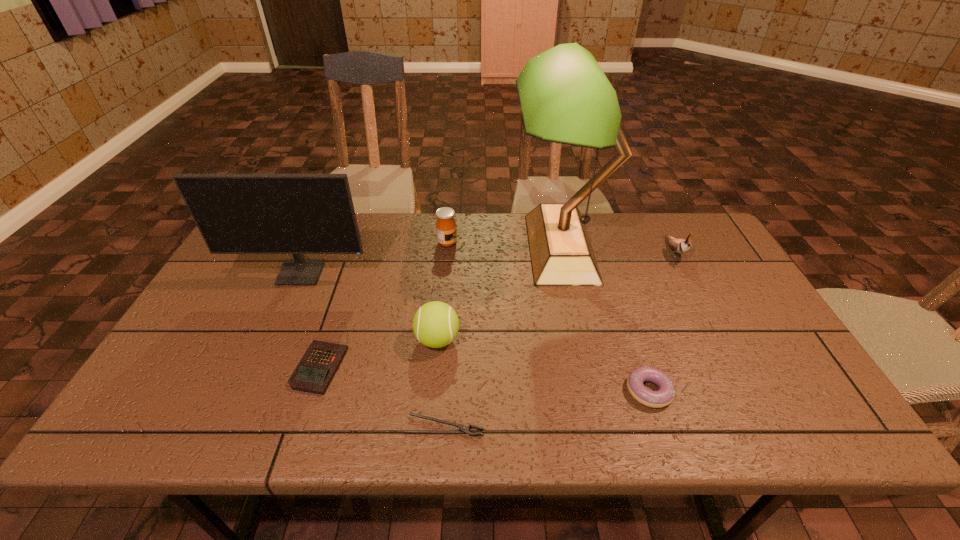
Locate an element on the screen. The height and width of the screenshot is (540, 960). honey located at the far edge is located at coordinates (446, 231).

I want to click on bird positioned at the far edge, so click(681, 246).

Image resolution: width=960 pixels, height=540 pixels. In order to click on doughnut located at the near edge in this screenshot , I will do `click(665, 395)`.

Locate an element on the screen. Image resolution: width=960 pixels, height=540 pixels. tongs present at the near edge is located at coordinates (463, 429).

Find the location of a particular element. object located in the left edge section of the desktop is located at coordinates (297, 214).

The width and height of the screenshot is (960, 540). What are the coordinates of `object that is at the right edge` in the screenshot? It's located at (681, 246).

Identify the location of object that is at the far right corner. Image resolution: width=960 pixels, height=540 pixels. (681, 246).

The height and width of the screenshot is (540, 960). Identify the location of vacant space at the far edge. (632, 244).

In the image, there is a desktop. Identify the location of vacant space at the near edge. Image resolution: width=960 pixels, height=540 pixels. (731, 406).

Where is `free region at the left edge of the desktop`? This screenshot has height=540, width=960. free region at the left edge of the desktop is located at coordinates (181, 332).